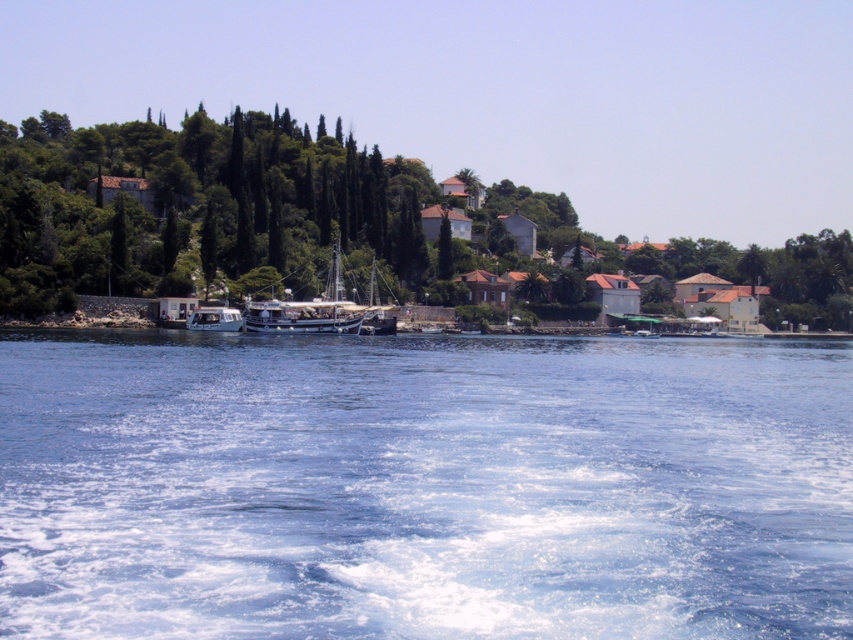
Question: Which of the following is the closest to the observer?

Choices:
 (A) tap(844, 317)
 (B) tap(204, 323)

Answer: (B)

Question: Can you confirm if blue liquid water at lower center is bigger than white glossy boat at center?

Choices:
 (A) no
 (B) yes

Answer: (B)

Question: Can you confirm if wooden sailboat at center is wider than white glossy boat at center?

Choices:
 (A) no
 (B) yes

Answer: (B)

Question: Considering the relative positions of blue liquid water at lower center and white glossy boat at center in the image provided, where is blue liquid water at lower center located with respect to white glossy boat at center?

Choices:
 (A) left
 (B) right

Answer: (B)

Question: Which object appears closest to the camera in this image?

Choices:
 (A) white glossy boat at center
 (B) green leafy tree at center
 (C) wooden sailboat at center
 (D) blue liquid water at lower center

Answer: (D)

Question: Among these objects, which one is farthest from the camera?

Choices:
 (A) wooden sailboat at center
 (B) green leafy tree at center
 (C) blue liquid water at lower center

Answer: (B)